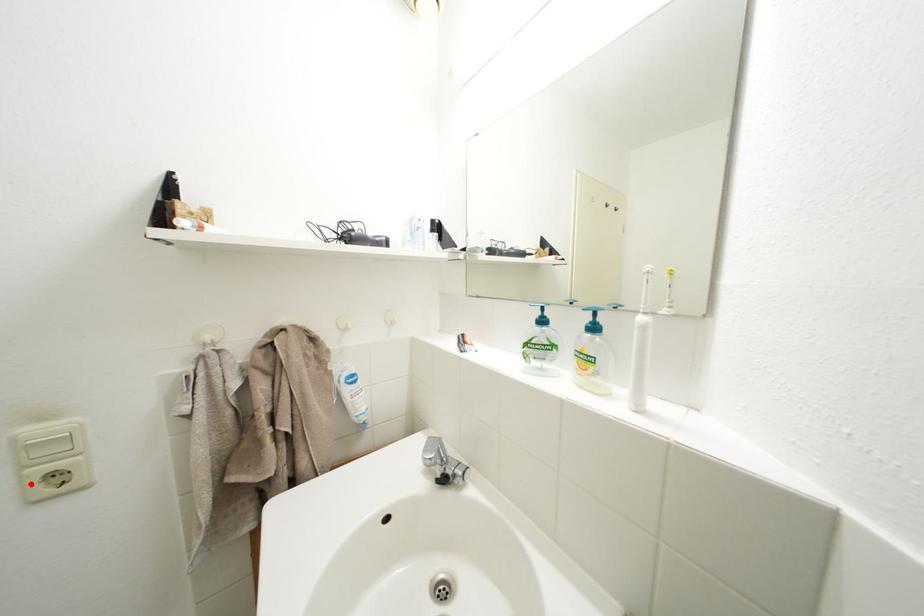
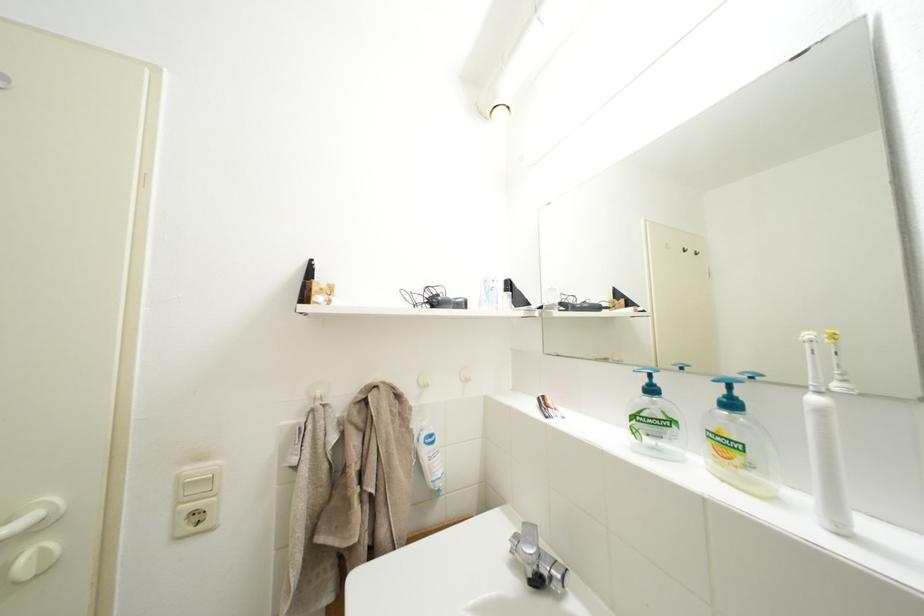
Locate, in the second image, the point that corresponds to the highlighted location in the first image.

(185, 519)